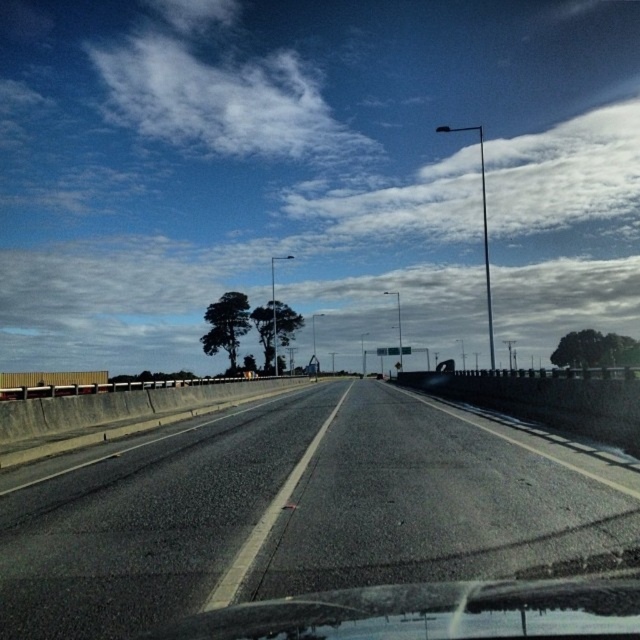
Who is higher up, black asphalt highway at center or transparent glass windshield at lower center?

Positioned higher is transparent glass windshield at lower center.

Does black asphalt highway at center have a lesser height compared to transparent glass windshield at lower center?

No, black asphalt highway at center is not shorter than transparent glass windshield at lower center.

Is point (440, 516) positioned behind point (372, 634)?

Yes.

Image resolution: width=640 pixels, height=640 pixels. I want to click on black asphalt highway at center, so click(x=292, y=509).